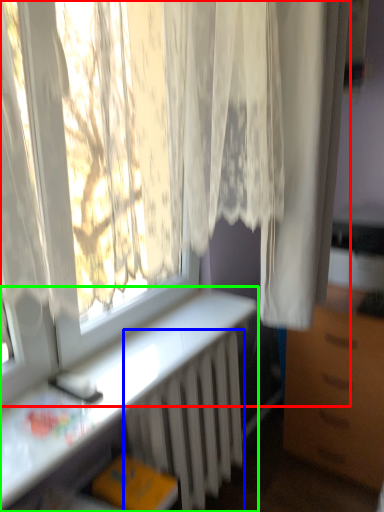
Question: Which object is positioned farthest from curtain (highlighted by a red box)? Select from radiator (highlighted by a blue box) and desk (highlighted by a green box).

Choices:
 (A) radiator
 (B) desk

Answer: (A)